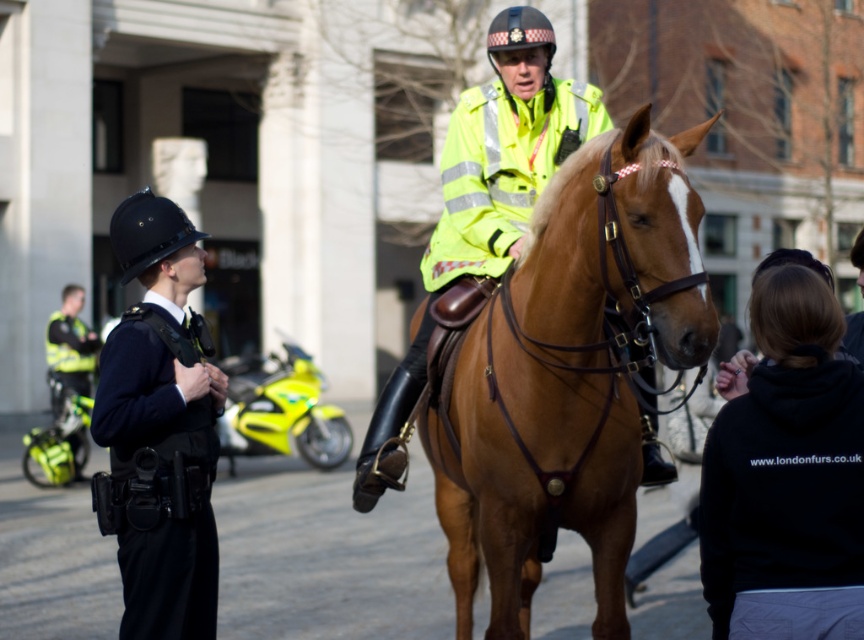
You are a pedestrian standing at the edge of the scene. You need to cross the space between the brown leather horse at center and the dark blue uniform at left to reach a nearby bench. Considering your height is 5 feet 6 inches, will you be able to pass through the space between them without ducking?

The distance between the brown leather horse at center and the dark blue uniform at left is 5.78 feet. Since your height is 5 feet 6 inches, which is 5.5 feet, the space is wider than your height. Therefore, you can pass through without needing to duck.